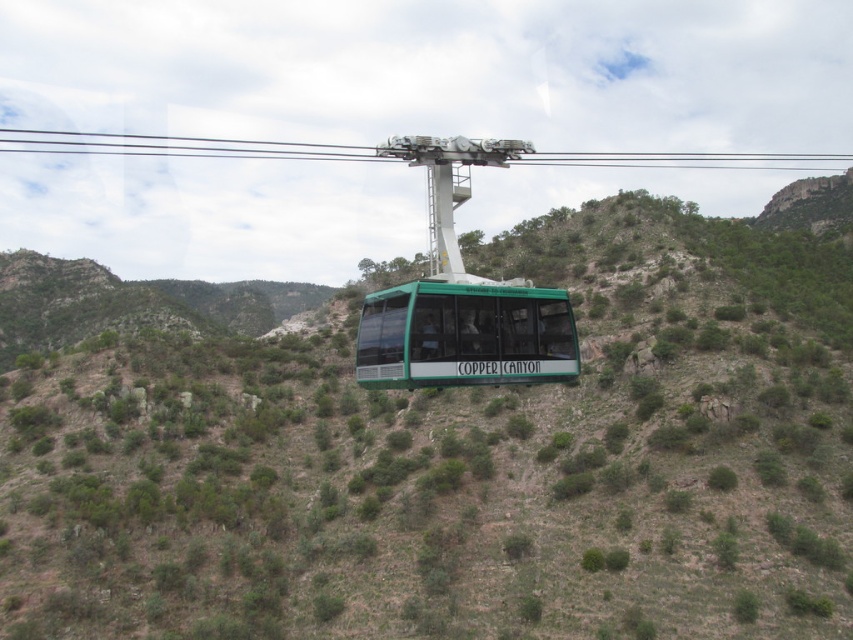
Is point (27, 445) behind point (467, 300)?

That is True.

Consider the image. Does green matte cable car at center have a larger size compared to green matte/glass cable car at center?

Yes.

The image size is (853, 640). Describe the element at coordinates (450, 456) in the screenshot. I see `green matte cable car at center` at that location.

Image resolution: width=853 pixels, height=640 pixels. I want to click on green matte cable car at center, so click(x=450, y=456).